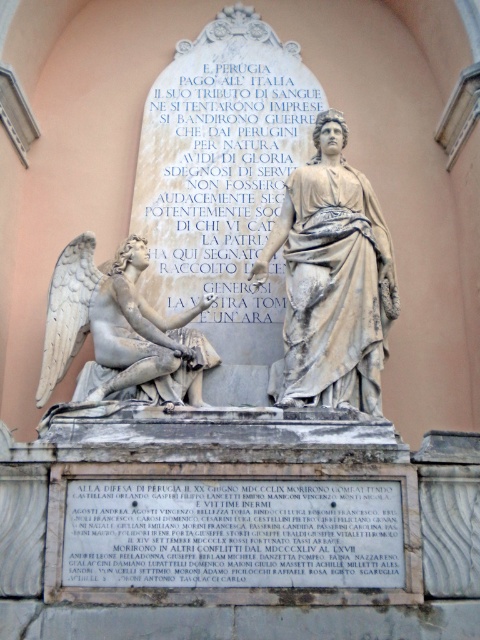
Who is taller, white marble inscription at upper center or gray marble statue at center?

With more height is white marble inscription at upper center.

Does white marble inscription at upper center appear on the left side of gray marble statue at center?

Correct, you'll find white marble inscription at upper center to the left of gray marble statue at center.

Which is in front, point (159, 228) or point (320, 384)?

Point (320, 384) is in front.

Where is `white marble inscription at upper center`? The width and height of the screenshot is (480, 640). white marble inscription at upper center is located at coordinates (219, 173).

Which is more to the right, gray marble statue at center or white marble angel at left?

gray marble statue at center is more to the right.

Is gray marble statue at center wider than white marble angel at left?

Incorrect, gray marble statue at center's width does not surpass white marble angel at left's.

Is point (287, 212) closer to camera compared to point (144, 352)?

No, (287, 212) is behind (144, 352).

The height and width of the screenshot is (640, 480). I want to click on gray marble statue at center, so click(x=333, y=280).

The width and height of the screenshot is (480, 640). What do you see at coordinates (224, 189) in the screenshot?
I see `white marble statue at center` at bounding box center [224, 189].

Who is positioned more to the right, white marble statue at center or gray marble statue at center?

Positioned to the right is gray marble statue at center.

Identify the location of white marble statue at center. Image resolution: width=480 pixels, height=640 pixels. (224, 189).